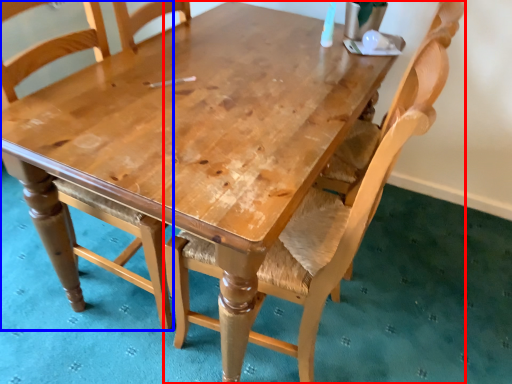
Question: Which object appears closest to the camera in this image, chair (highlighted by a red box) or chair (highlighted by a blue box)?

Choices:
 (A) chair
 (B) chair

Answer: (A)